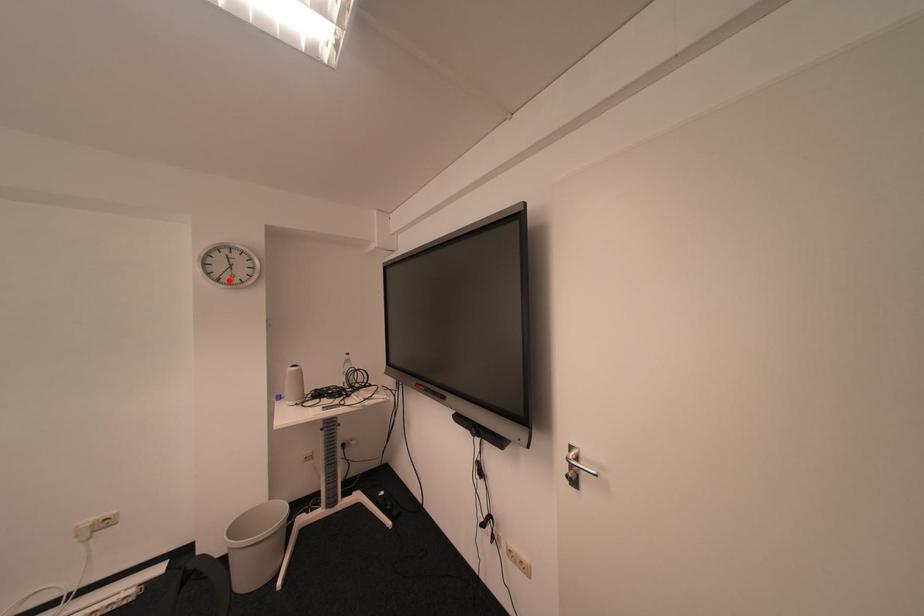
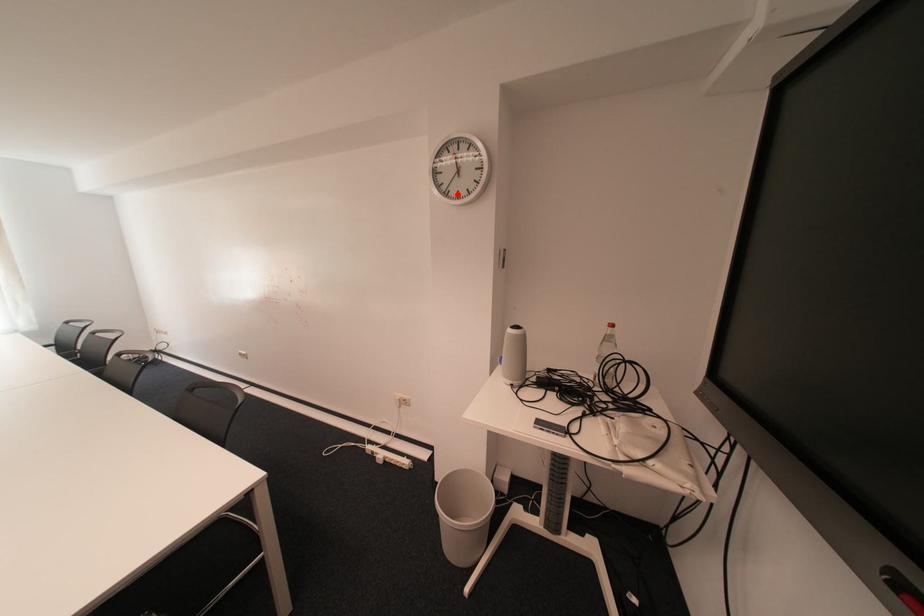
I am providing you with two images of the same scene from different viewpoints. A red point is marked on the first image and another point is marked on the second image. Do the highlighted points in image1 and image2 indicate the same real-world spot?

Yes